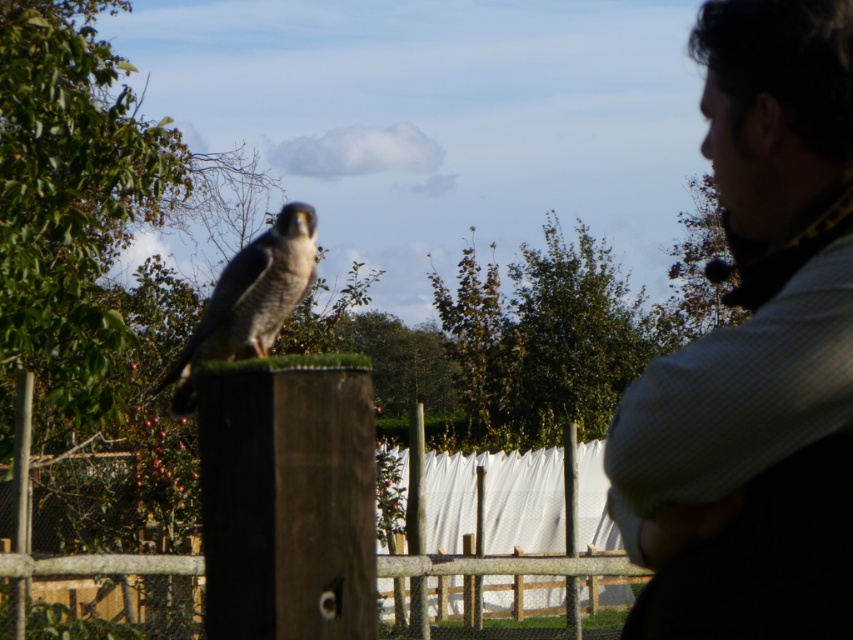
Does checkered fabric shirt at right have a smaller size compared to dark brown feathers at center?

Yes, checkered fabric shirt at right is smaller than dark brown feathers at center.

Is point (675, 401) positioned before point (277, 314)?

That is True.

Is point (827, 448) more distant than point (177, 385)?

No, it is not.

Find the location of `checkered fabric shirt at right`. checkered fabric shirt at right is located at coordinates (756, 353).